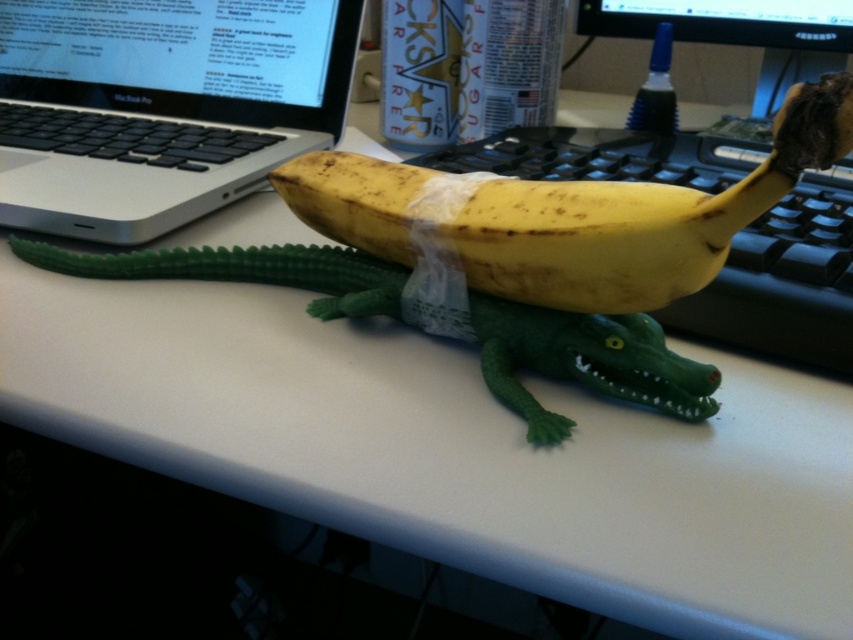
You are a drone operator trying to navigate between two points on a desk. The first point is at coordinates point (187, 13) and the second point is at coordinates point (809, 51). Which point is closer to you when you are hovering above the desk?

Point (187, 13) is closer to you because it is further to the viewer than point (809, 51), meaning it is positioned nearer in the 3D space relative to your vantage point.

You are organizing items on a desk and need to place a new item between the silver metallic laptop at upper left and the green plastic toy alligator lying horizontally across the desk. Can you determine if there is enough space between them for the new item?

The silver metallic laptop at upper left is located at point (160, 106). However, without knowing the position of the green plastic toy alligator lying horizontally across the desk or the size of the new item, it is impossible to determine if there is enough space between them for the new item.

You are organizing items on a desk and need to place a new item between the silver metallic laptop at upper left and the yellow matte banana at center. Based on their positions, where should you place the new item?

The silver metallic laptop at upper left is located above the yellow matte banana at center, so you should place the new item between them in the space below the laptop and above the banana.